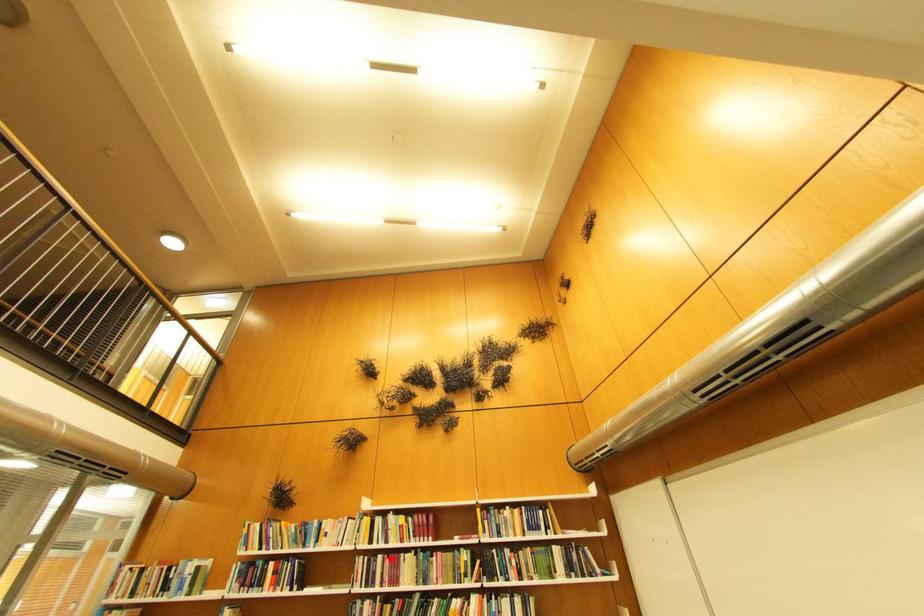
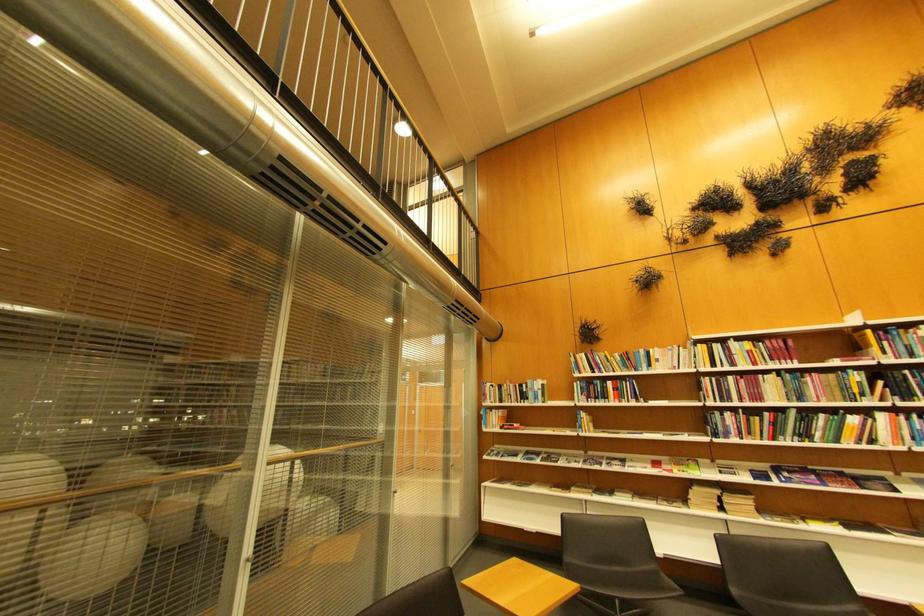
In the second image, find the point that corresponds to the highlighted location in the first image.

(740, 379)